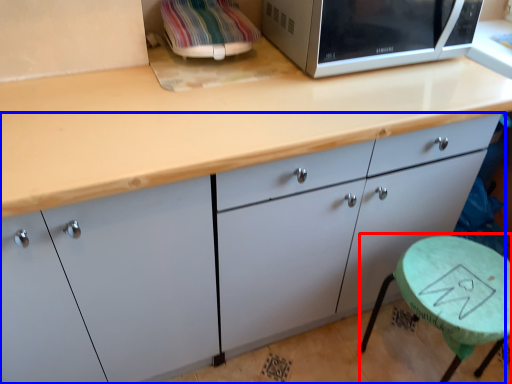
Question: Which object is closer to the camera taking this photo, round table (highlighted by a red box) or cabinetry (highlighted by a blue box)?

Choices:
 (A) round table
 (B) cabinetry

Answer: (B)